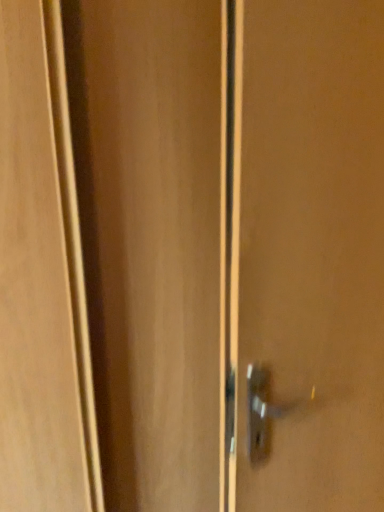
In order to face matte silver handle at center, should I rotate leftwards or rightwards?

To align with it, rotate right about 18.981°.

Describe the element at coordinates (314, 247) in the screenshot. The height and width of the screenshot is (512, 384). I see `matte silver handle at center` at that location.

Locate an element on the screen. matte silver handle at center is located at coordinates (314, 247).

Where is `matte silver handle at center`? This screenshot has height=512, width=384. matte silver handle at center is located at coordinates coord(314,247).